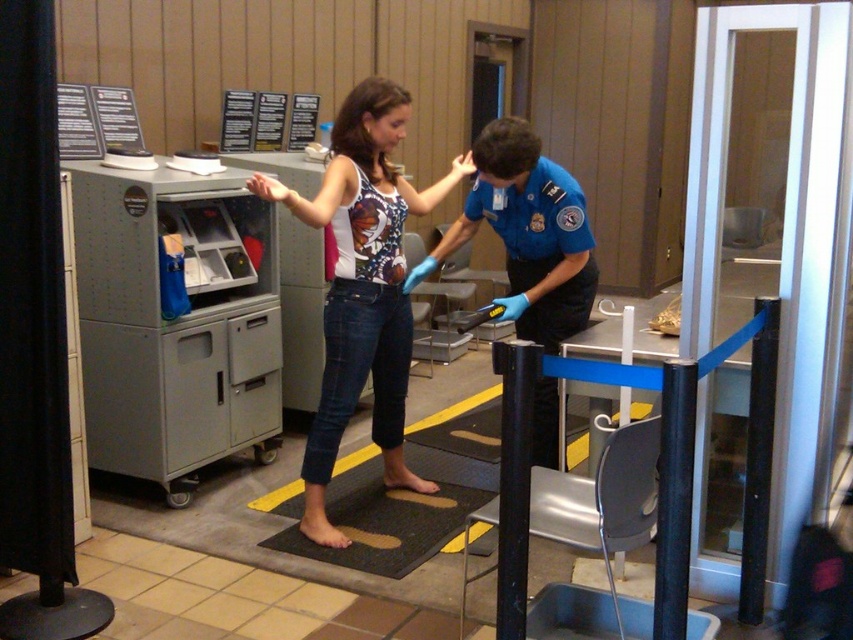
You are a security officer at the checkpoint. You need to check the position of the matte white tank top at center. According to the system coordinates, where exactly is it located?

The matte white tank top at center is located at point (363, 285).

You are a security officer at the checkpoint. You notice a passenger wearing a matte white tank top at center and a blue uniform at center. Which clothing item is positioned more to the left side of the scene?

The matte white tank top at center is positioned to the left of the blue uniform at center, so it is more to the left side of the scene.

You are a security officer at the checkpoint. You need to verify the distance between the matte white tank top at center and the camera to ensure compliance with safety protocols. According to the system, the minimum safe distance required is 2 meters. Is the current distance compliant?

The matte white tank top at center and camera are 2.66 meters apart from each other, which exceeds the minimum required distance of 2 meters. Therefore, the current distance is compliant with safety protocols.